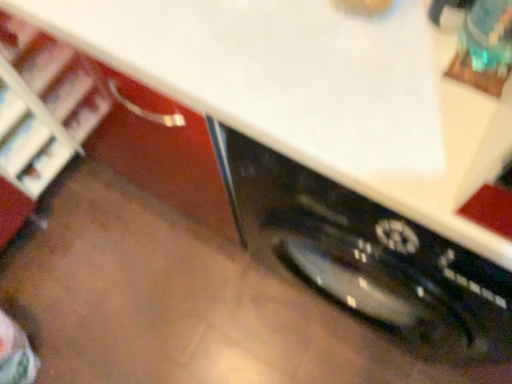
This screenshot has height=384, width=512. What do you see at coordinates (315, 91) in the screenshot?
I see `glossy wood cabinet at lower left` at bounding box center [315, 91].

Image resolution: width=512 pixels, height=384 pixels. I want to click on glossy wood cabinet at lower left, so click(x=315, y=91).

I want to click on glossy wood cabinet at lower left, so click(315, 91).